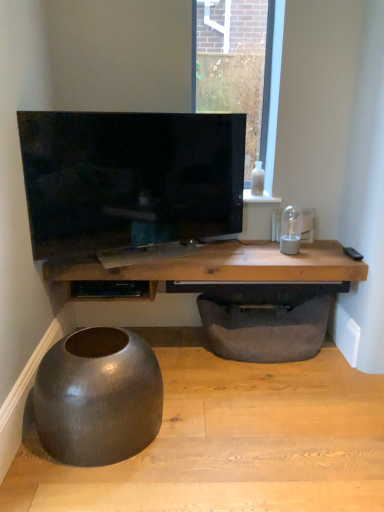
Question: From the image's perspective, does white glossy bottle at upper right appear lower than wooden table at center?

Choices:
 (A) no
 (B) yes

Answer: (A)

Question: Considering the relative positions of white glossy bottle at upper right and wooden table at center in the image provided, is white glossy bottle at upper right to the right of wooden table at center from the viewer's perspective?

Choices:
 (A) no
 (B) yes

Answer: (B)

Question: From the image's perspective, is white glossy bottle at upper right on wooden table at center?

Choices:
 (A) no
 (B) yes

Answer: (B)

Question: Can you confirm if white glossy bottle at upper right is shorter than wooden table at center?

Choices:
 (A) no
 (B) yes

Answer: (B)

Question: Can you confirm if white glossy bottle at upper right is taller than wooden table at center?

Choices:
 (A) yes
 (B) no

Answer: (B)

Question: Considering the relative positions of wooden table at center and dark gray fabric footrest at lower center in the image provided, is wooden table at center to the left or to the right of dark gray fabric footrest at lower center?

Choices:
 (A) right
 (B) left

Answer: (B)

Question: Looking at their shapes, would you say wooden table at center is wider or thinner than dark gray fabric footrest at lower center?

Choices:
 (A) wide
 (B) thin

Answer: (A)

Question: Is wooden table at center taller or shorter than dark gray fabric footrest at lower center?

Choices:
 (A) short
 (B) tall

Answer: (A)

Question: From the image's perspective, is wooden table at center above or below dark gray fabric footrest at lower center?

Choices:
 (A) above
 (B) below

Answer: (A)

Question: In terms of width, does white glossy bottle at upper right look wider or thinner when compared to matte black bowl at lower left?

Choices:
 (A) thin
 (B) wide

Answer: (A)

Question: From a real-world perspective, is white glossy bottle at upper right positioned above or below matte black bowl at lower left?

Choices:
 (A) above
 (B) below

Answer: (A)

Question: Considering the positions of white glossy bottle at upper right and matte black bowl at lower left in the image, is white glossy bottle at upper right bigger or smaller than matte black bowl at lower left?

Choices:
 (A) big
 (B) small

Answer: (B)

Question: In terms of height, does white glossy bottle at upper right look taller or shorter compared to matte black bowl at lower left?

Choices:
 (A) tall
 (B) short

Answer: (B)

Question: In terms of width, does white glossy bottle at upper right look wider or thinner when compared to wooden table at center?

Choices:
 (A) thin
 (B) wide

Answer: (A)

Question: Relative to wooden table at center, is white glossy bottle at upper right in front or behind?

Choices:
 (A) behind
 (B) front

Answer: (A)